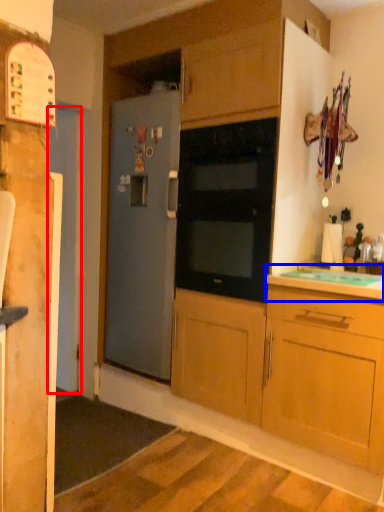
Question: Which object appears farthest to the camera in this image, door (highlighted by a red box) or countertop (highlighted by a blue box)?

Choices:
 (A) door
 (B) countertop

Answer: (A)